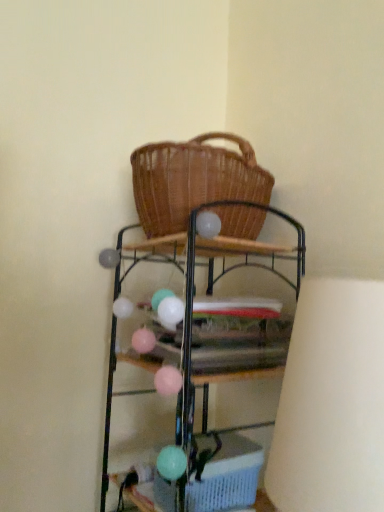
Question: Looking at the image, does metallic wire shelf at center seem bigger or smaller compared to light blue plastic basket at lower center?

Choices:
 (A) small
 (B) big

Answer: (B)

Question: From the image's perspective, is metallic wire shelf at center located above or below light blue plastic basket at lower center?

Choices:
 (A) above
 (B) below

Answer: (A)

Question: From a real-world perspective, is metallic wire shelf at center physically located above or below light blue plastic basket at lower center?

Choices:
 (A) above
 (B) below

Answer: (A)

Question: Looking at the image, does light blue plastic basket at lower center seem bigger or smaller compared to metallic wire shelf at center?

Choices:
 (A) small
 (B) big

Answer: (A)

Question: Is light blue plastic basket at lower center inside the boundaries of metallic wire shelf at center, or outside?

Choices:
 (A) outside
 (B) inside

Answer: (B)

Question: Considering the positions of point (231, 501) and point (185, 375), is point (231, 501) closer or farther from the camera than point (185, 375)?

Choices:
 (A) farther
 (B) closer

Answer: (A)

Question: From the image's perspective, is light blue plastic basket at lower center located above or below metallic wire shelf at center?

Choices:
 (A) below
 (B) above

Answer: (A)